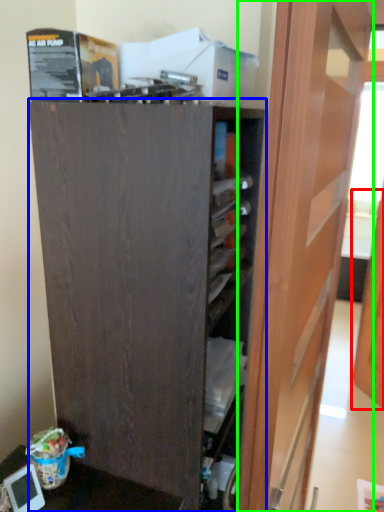
Question: Estimate the real-world distances between objects in this image. Which object is closer to door (highlighted by a red box), cupboard (highlighted by a blue box) or door (highlighted by a green box)?

Choices:
 (A) cupboard
 (B) door

Answer: (B)